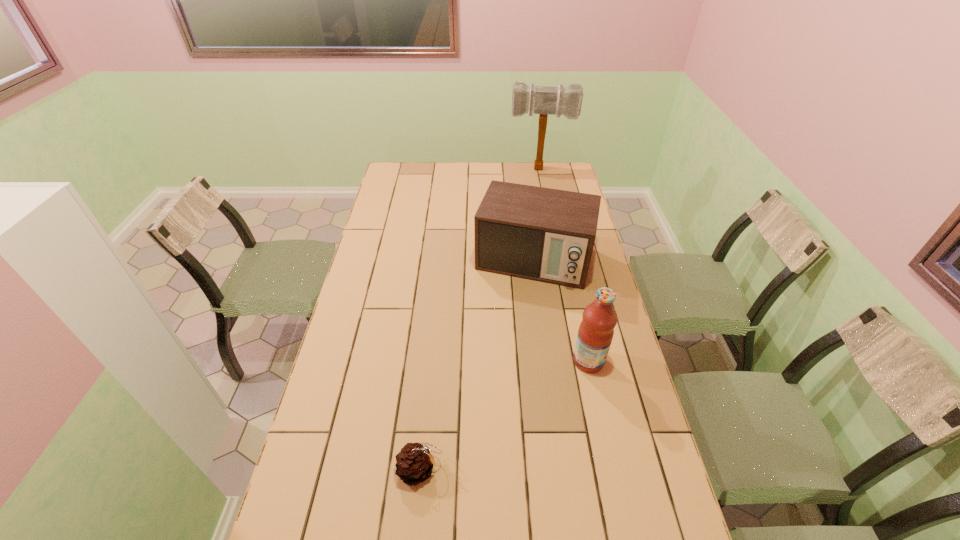
Locate an element on the screen. This screenshot has width=960, height=540. free spot on the desktop that is between the pinecone and the second nearest object and is positioned at the head of the farthest object is located at coordinates (535, 395).

You are a GUI agent. You are given a task and a screenshot of the screen. Output one action in this format:
    pyautogui.click(x=<x>, y=<y>)
    Task: Click on the vacant space on the desktop that is between the pinecone and the second nearest object and is positioned on the front-facing side of the radio receiver
    
    Given the screenshot: What is the action you would take?
    pyautogui.click(x=488, y=426)